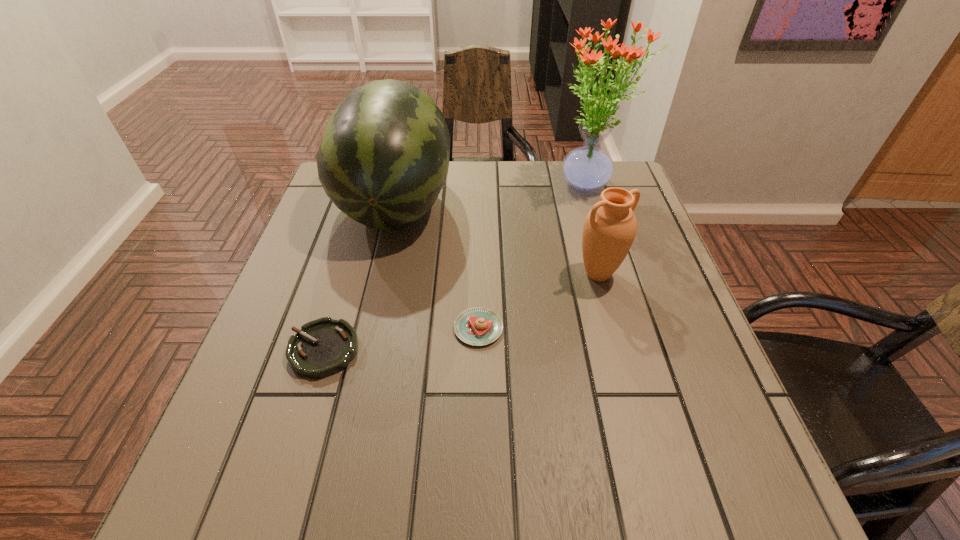
Locate an element on the screen. free spot between the fourth shortest object and the third object from right to left is located at coordinates click(437, 266).

Where is `free spot between the flower arrangement and the third object from right to left`? free spot between the flower arrangement and the third object from right to left is located at coordinates (533, 256).

Identify the location of object that is the third closest one to the ashtray. The width and height of the screenshot is (960, 540). (610, 227).

Select which object is the third closest to the third nearest object. Please provide its 2D coordinates. Your answer should be formatted as a tuple, i.e. [(x, y)], where the tuple contains the x and y coordinates of a point satisfying the conditions above.

[(384, 157)]

Locate an element on the screen. Image resolution: width=960 pixels, height=540 pixels. free spot that satisfies the following two spatial constraints: 1. on the back side of the urn; 2. on the left side of the ashtray is located at coordinates (347, 274).